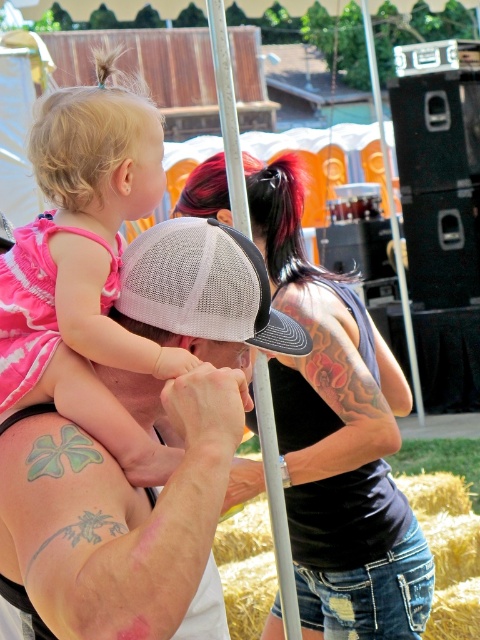
You are a GUI agent. You are given a task and a screenshot of the screen. Output one action in this format:
    pyautogui.click(x=<x>, y=<y>)
    Task: Click on the pink fabric dress at upper left
    
    Given the screenshot: What is the action you would take?
    pyautogui.click(x=84, y=268)

Which is in front, point (96, 193) or point (219, 305)?

Point (219, 305) is more forward.

Find the location of a particular element. pink fabric dress at upper left is located at coordinates (84, 268).

Which is behind, point (354, 445) or point (210, 3)?

The point (354, 445) is behind.

Is black mesh cap at center shorter than silver metallic pole at center?

No.

Image resolution: width=480 pixels, height=640 pixels. Describe the element at coordinates (337, 438) in the screenshot. I see `black mesh cap at center` at that location.

This screenshot has width=480, height=640. I want to click on black mesh cap at center, so click(x=337, y=438).

Can you confirm if pink fabric dress at upper left is positioned below rusty straw bale at lower right?

Actually, pink fabric dress at upper left is above rusty straw bale at lower right.

The width and height of the screenshot is (480, 640). Identify the location of pink fabric dress at upper left. (84, 268).

Where is `pink fabric dress at upper left`? The width and height of the screenshot is (480, 640). pink fabric dress at upper left is located at coordinates (84, 268).